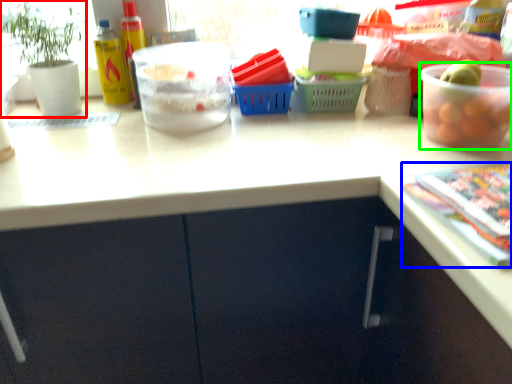
Question: Based on their relative distances, which object is farther from houseplant (highlighted by a red box)? Choose from magazine (highlighted by a blue box) and bowl (highlighted by a green box).

Choices:
 (A) magazine
 (B) bowl

Answer: (A)